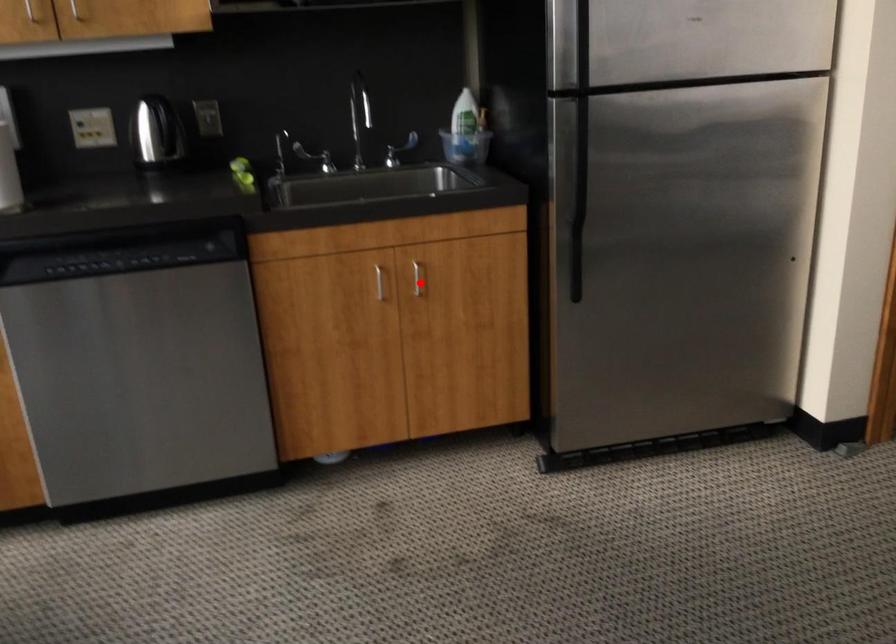
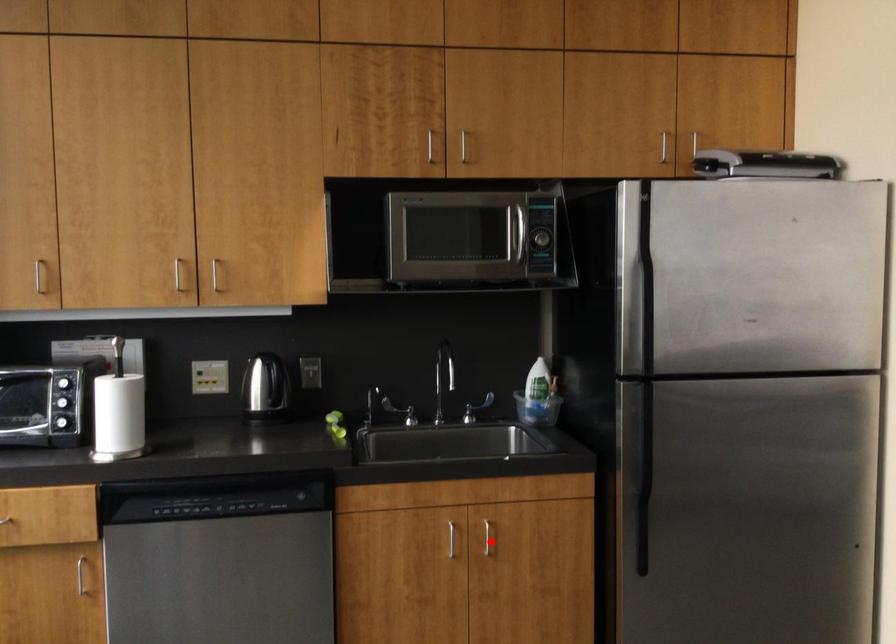
I am providing you with two images of the same scene from different viewpoints. A red point is marked on the first image and another point is marked on the second image. Does the point marked in image1 correspond to the same location as the one in image2?

Yes